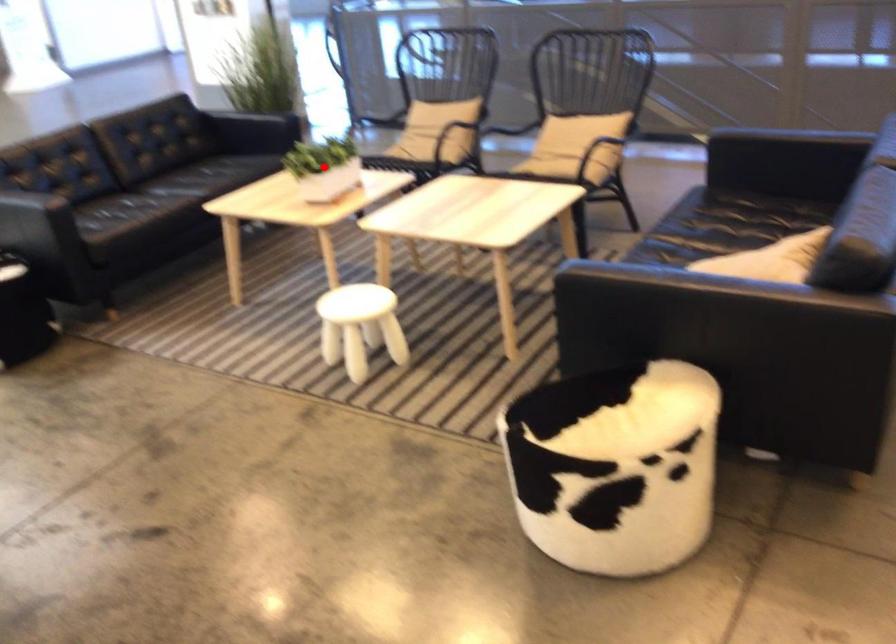
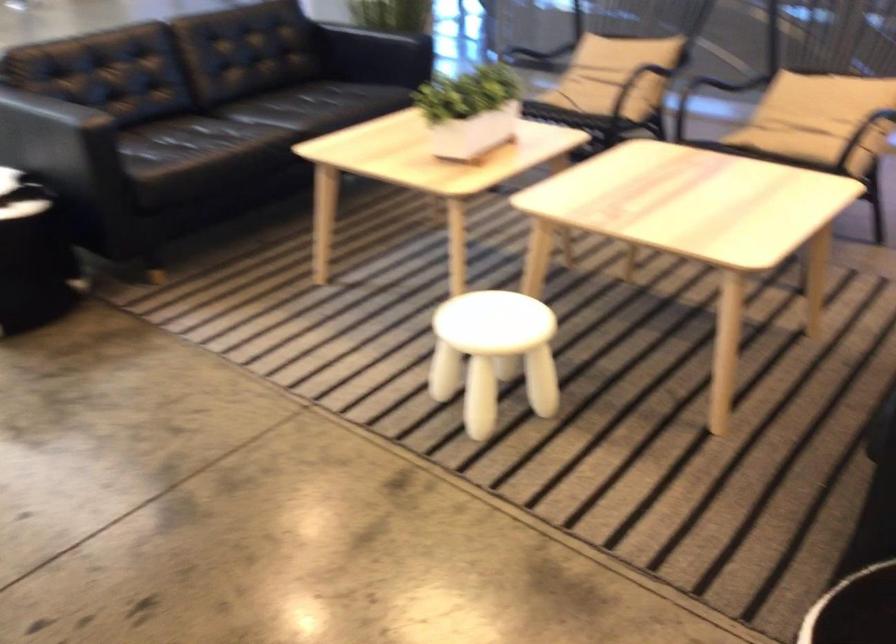
Question: I am providing you with two images of the same scene from different viewpoints. A red point is marked on the first image. Can you still see the location of the red point in image 2?

Choices:
 (A) Yes
 (B) No

Answer: (A)